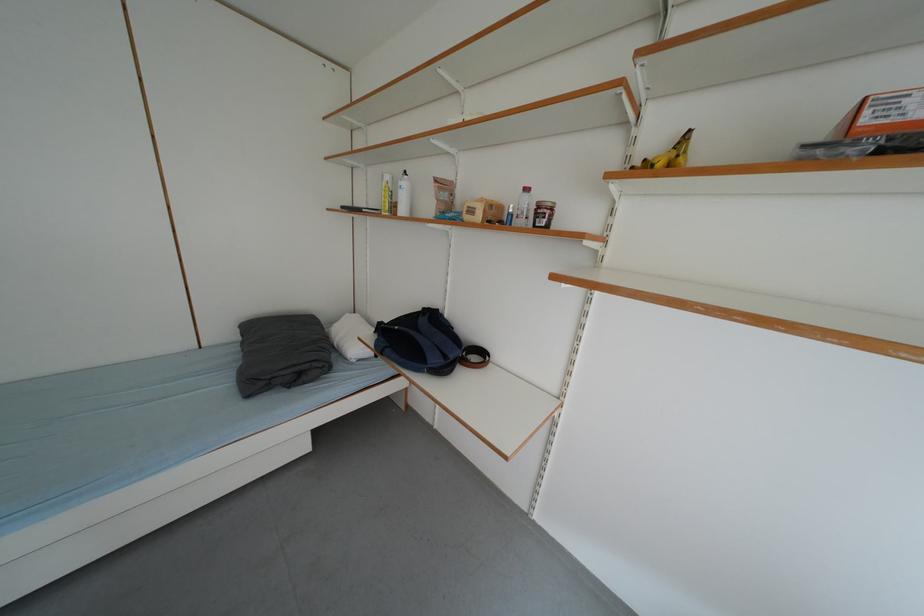
The location [404,195] corresponds to which object?

It corresponds to the white water bottle in the image.